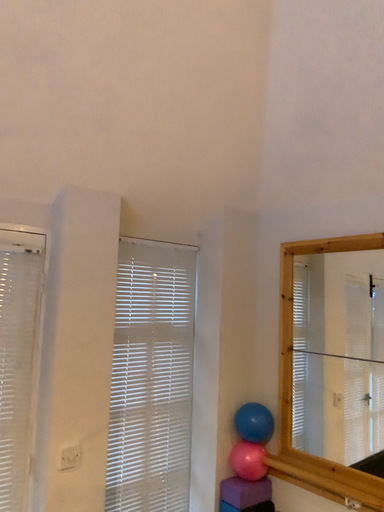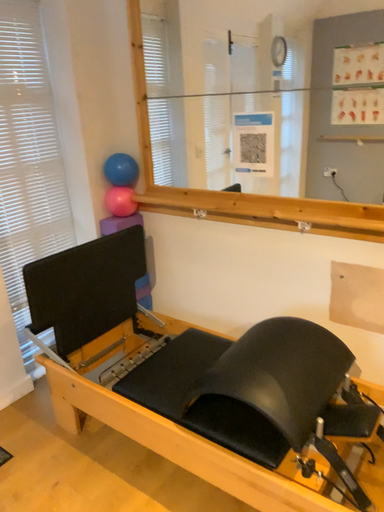
Question: Which way did the camera rotate in the video?

Choices:
 (A) rotated left
 (B) rotated right

Answer: (B)